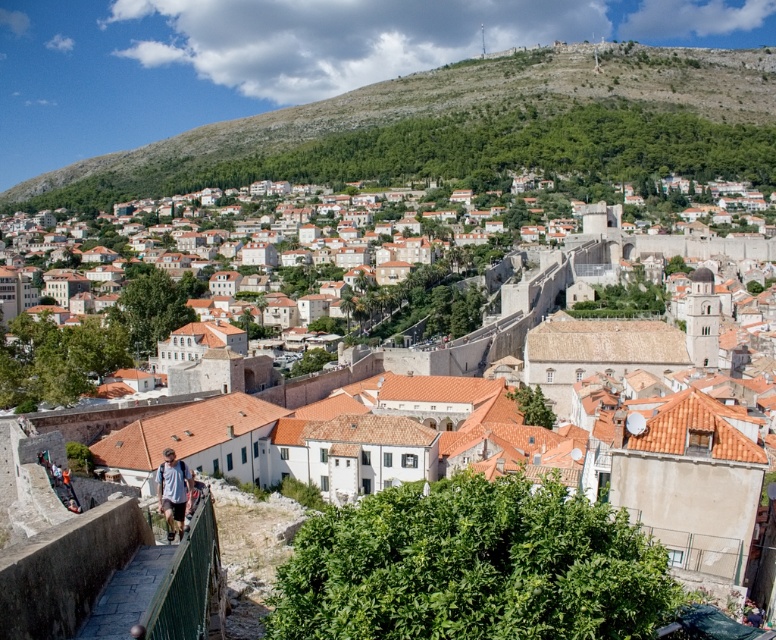
From the picture: Which is more to the left, green textured hillside at upper center or light blue denim jeans at lower left?

light blue denim jeans at lower left

Does point (632, 125) come in front of point (175, 465)?

No.

Between point (260, 163) and point (182, 476), which one is positioned in front?

Positioned in front is point (182, 476).

Find the location of a particular element. green textured hillside at upper center is located at coordinates (470, 128).

Does white stone town at center have a lesser height compared to light blue denim jeans at lower left?

In fact, white stone town at center may be taller than light blue denim jeans at lower left.

Does white stone town at center have a lesser width compared to light blue denim jeans at lower left?

No.

Where is `white stone town at center`? Image resolution: width=776 pixels, height=640 pixels. white stone town at center is located at coordinates (707, 506).

Is green textured hillside at upper center smaller than white stone town at center?

No.

Is point (546, 116) in front of point (688, 490)?

No, it is behind (688, 490).

Identify the location of green textured hillside at upper center. (470, 128).